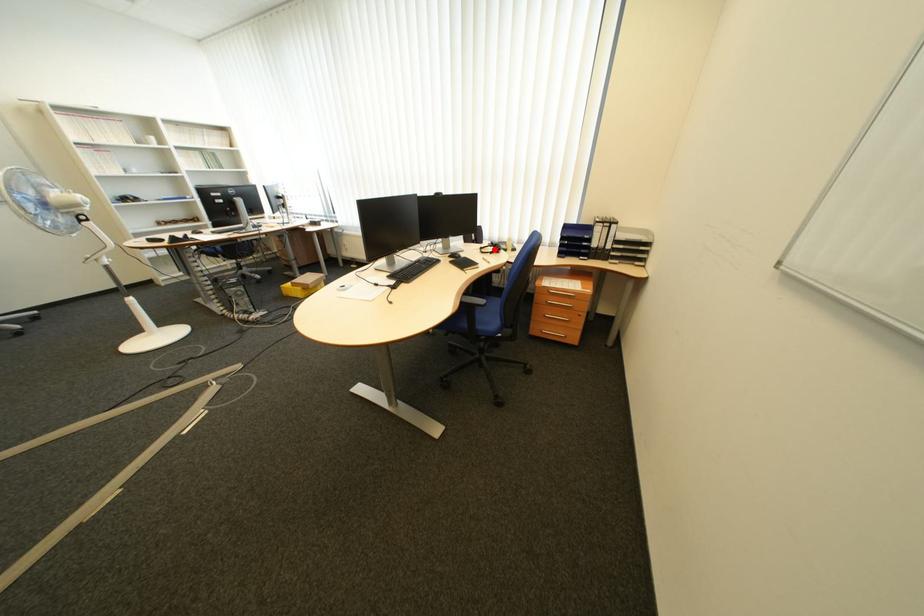
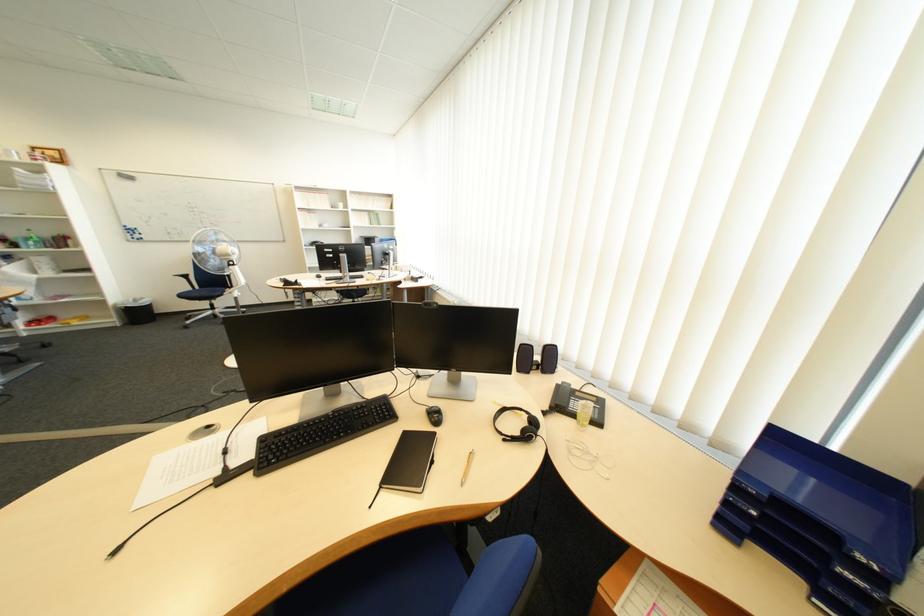
Question: I am providing you with two images of the same scene from different viewpoints. Given a red point in image1, look at the same physical point in image2. Is it:

Choices:
 (A) Closer to the viewpoint
 (B) Farther from the viewpoint

Answer: (B)